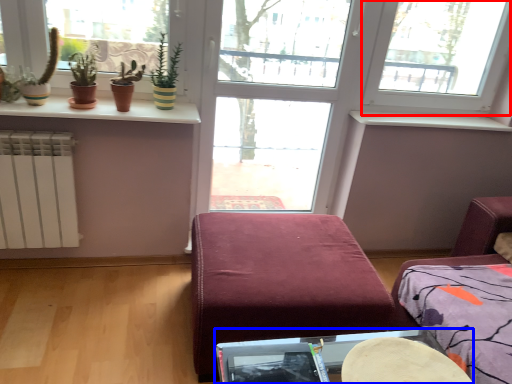
Question: Which point is further to the camera, window (highlighted by a red box) or table (highlighted by a blue box)?

Choices:
 (A) window
 (B) table

Answer: (A)